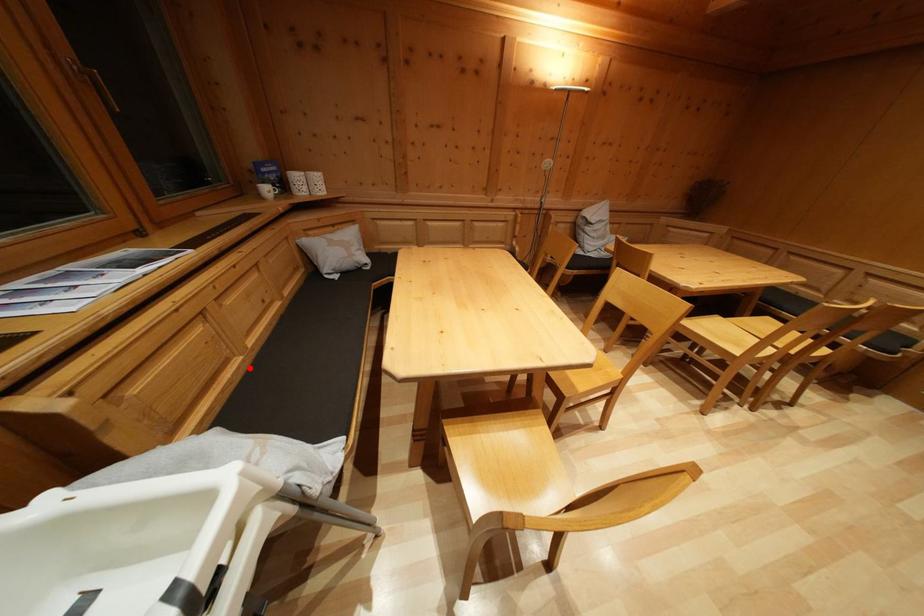
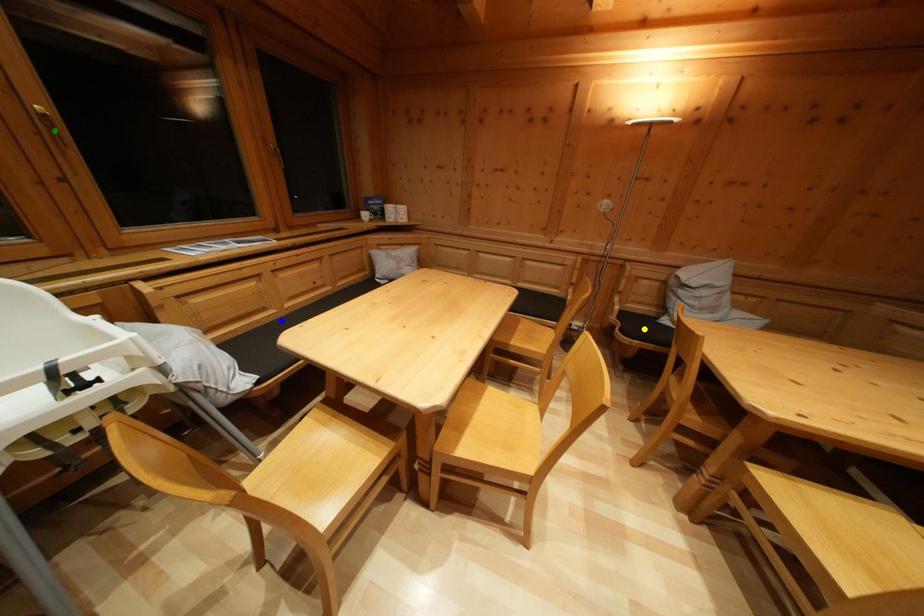
Question: I am providing you with two images of the same scene from different viewpoints. A red point is marked on the first image. You are given multiple points on the second image. In image 2, which mark is for the same physical point as the one in image 1?

Choices:
 (A) blue point
 (B) yellow point
 (C) green point

Answer: (A)